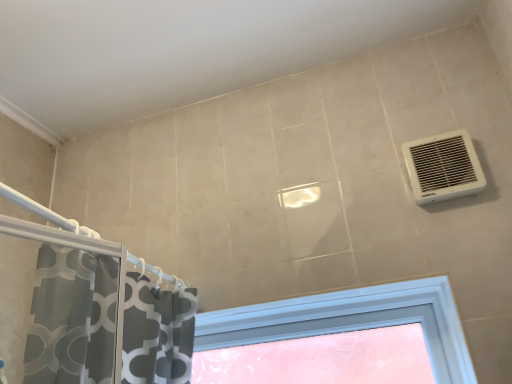
You are a GUI agent. You are given a task and a screenshot of the screen. Output one action in this format:
    pyautogui.click(x=<x>, y=<y>)
    Task: Click on the white plastic vent at upper right
    The width and height of the screenshot is (512, 384).
    Given the screenshot: What is the action you would take?
    pyautogui.click(x=443, y=167)

This screenshot has width=512, height=384. Describe the element at coordinates (443, 167) in the screenshot. I see `white plastic vent at upper right` at that location.

Describe the element at coordinates (351, 321) in the screenshot. I see `translucent plastic window at center` at that location.

Where is `translucent plastic window at center`? translucent plastic window at center is located at coordinates click(351, 321).

This screenshot has height=384, width=512. In order to click on white plastic vent at upper right in this screenshot , I will do `click(443, 167)`.

Is translucent plastic window at center to the left of white plastic vent at upper right from the viewer's perspective?

Indeed, translucent plastic window at center is positioned on the left side of white plastic vent at upper right.

In the scene shown: Is translucent plastic window at center further to camera compared to white plastic vent at upper right?

Yes, it is.

Which is closer to the camera, (441,320) or (466,157)?

Point (441,320) appears to be farther away from the viewer than point (466,157).

Looking at this image, from the image's perspective, would you say translucent plastic window at center is positioned over white plastic vent at upper right?

No, from the image's perspective, translucent plastic window at center is not over white plastic vent at upper right.

From a real-world perspective, which is physically above, translucent plastic window at center or white plastic vent at upper right?

white plastic vent at upper right, from a real-world perspective.

Looking at this image, considering the sizes of objects translucent plastic window at center and white plastic vent at upper right in the image provided, who is wider, translucent plastic window at center or white plastic vent at upper right?

Wider between the two is translucent plastic window at center.

From their relative heights in the image, would you say translucent plastic window at center is taller or shorter than white plastic vent at upper right?

In the image, translucent plastic window at center appears to be taller than white plastic vent at upper right.

Who is bigger, translucent plastic window at center or white plastic vent at upper right?

Bigger between the two is translucent plastic window at center.

Would you say translucent plastic window at center is inside or outside white plastic vent at upper right?

translucent plastic window at center is located beyond the bounds of white plastic vent at upper right.

Is translucent plastic window at center with white plastic vent at upper right?

There is a gap between translucent plastic window at center and white plastic vent at upper right.

Based on the photo, is translucent plastic window at center positioned with its back to white plastic vent at upper right?

No, translucent plastic window at center's orientation is not away from white plastic vent at upper right.

I want to click on window on the left side of white plastic vent at upper right, so click(351, 321).

Based on the photo, considering the positions of objects white plastic vent at upper right and translucent plastic window at center in the image provided, who is more to the left, white plastic vent at upper right or translucent plastic window at center?

Positioned to the left is translucent plastic window at center.

Considering the positions of objects white plastic vent at upper right and translucent plastic window at center in the image provided, who is in front, white plastic vent at upper right or translucent plastic window at center?

white plastic vent at upper right is closer to the camera.

Which is closer, (x=467, y=182) or (x=444, y=290)?

The point (x=444, y=290) is in front.

From the image's perspective, relative to translucent plastic window at center, is white plastic vent at upper right above or below?

white plastic vent at upper right is situated higher than translucent plastic window at center in the image.

From a real-world perspective, is white plastic vent at upper right positioned under translucent plastic window at center based on gravity?

Actually, white plastic vent at upper right is physically above translucent plastic window at center in the real world.

Considering the relative sizes of white plastic vent at upper right and translucent plastic window at center in the image provided, is white plastic vent at upper right wider than translucent plastic window at center?

Incorrect, the width of white plastic vent at upper right does not surpass that of translucent plastic window at center.

From their relative heights in the image, would you say white plastic vent at upper right is taller or shorter than translucent plastic window at center?

In the image, white plastic vent at upper right appears to be shorter than translucent plastic window at center.

Between white plastic vent at upper right and translucent plastic window at center, which one has smaller size?

With smaller size is white plastic vent at upper right.

Is white plastic vent at upper right inside the boundaries of translucent plastic window at center, or outside?

white plastic vent at upper right lies outside translucent plastic window at center.

Looking at this image, is white plastic vent at upper right beside translucent plastic window at center?

white plastic vent at upper right is not next to translucent plastic window at center, and they're not touching.

Is white plastic vent at upper right looking in the opposite direction of translucent plastic window at center?

white plastic vent at upper right is not turned away from translucent plastic window at center.

What's the angular difference between white plastic vent at upper right and translucent plastic window at center's facing directions?

The facing directions of white plastic vent at upper right and translucent plastic window at center are 0.163 degrees apart.

The image size is (512, 384). I want to click on air conditioning located on the right of translucent plastic window at center, so click(x=443, y=167).

Locate an element on the screen. The width and height of the screenshot is (512, 384). window behind the white plastic vent at upper right is located at coordinates (351, 321).

There is a translucent plastic window at center. In order to click on air conditioning above it (from a real-world perspective) in this screenshot , I will do `click(443, 167)`.